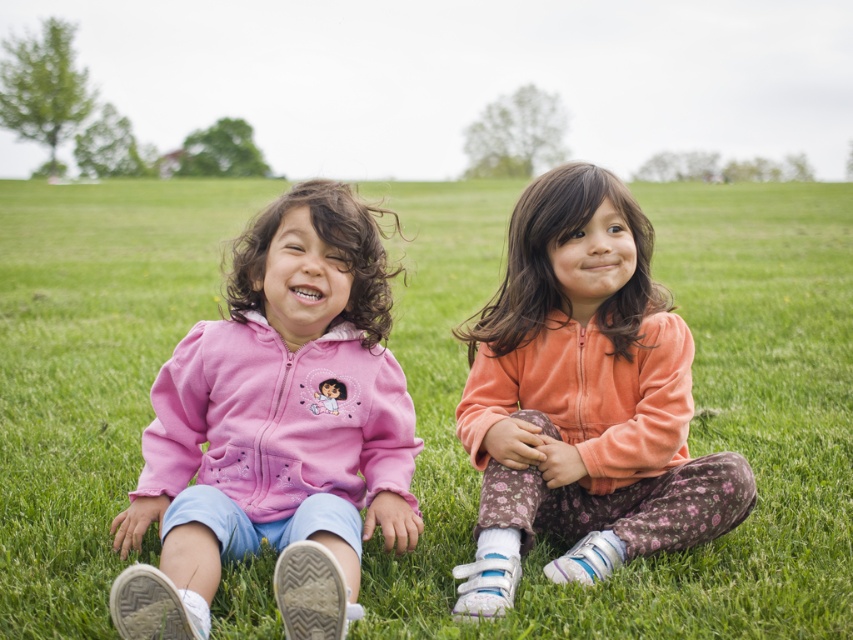
You are taking a photo of two children sitting on a grassy field under an overcast sky. The children are positioned at point (32, 476) and point (480, 419). Which child is closer to the camera?

The child at point (32, 476) is closer to the camera than the child at point (480, 419) because point (32, 476) is further to the camera than point (480, 419).

You are a photographer trying to capture both children in a single shot. Since you want to ensure both are in focus, you need to know which child is closer to you. Which child should you focus on first, the one in the pink fleece jackets at center or the pink fleece jacket at left?

You should focus on the pink fleece jackets at center first because it is closer to you than the pink fleece jacket at left, ensuring both will be in focus when starting with the nearer subject.